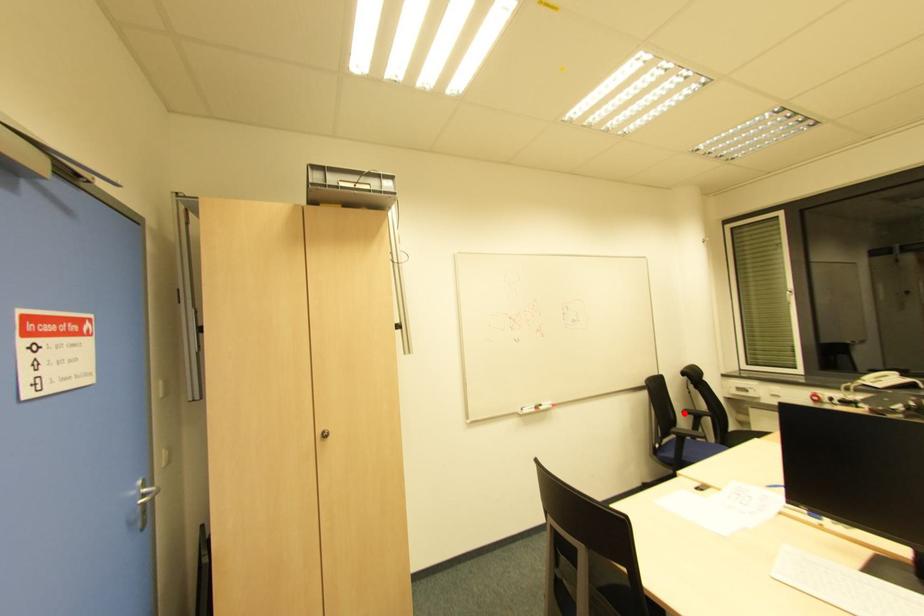
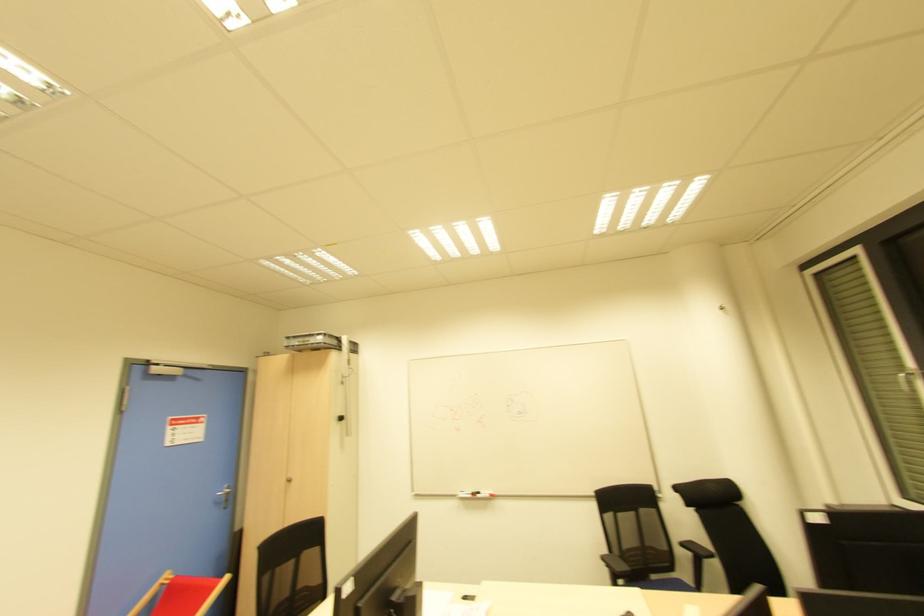
In the second image, find the point that corresponds to the highlighted location in the first image.

(681, 545)